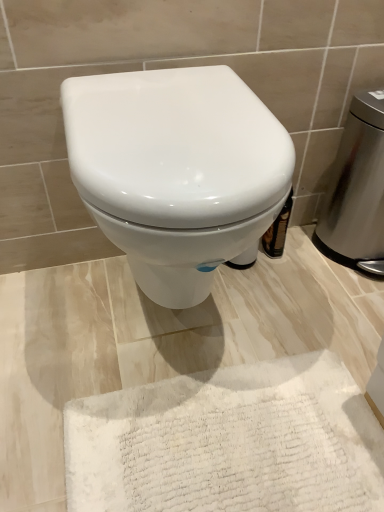
Where is `free location above white glossy toilet at center (from a real-world perspective)`? This screenshot has height=512, width=384. free location above white glossy toilet at center (from a real-world perspective) is located at coordinates (157, 86).